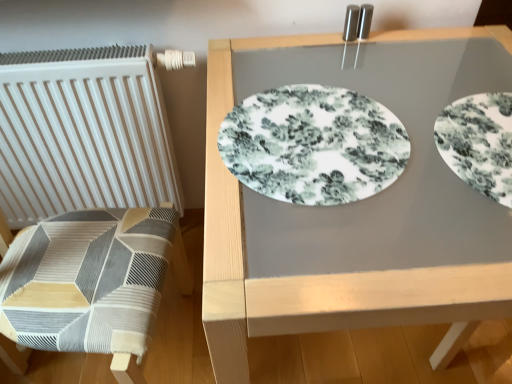
Identify the location of vacant space underneath white floral plate at center, the 1th plate in the left-to-right sequence (from a real-world perspective). The height and width of the screenshot is (384, 512). (304, 137).